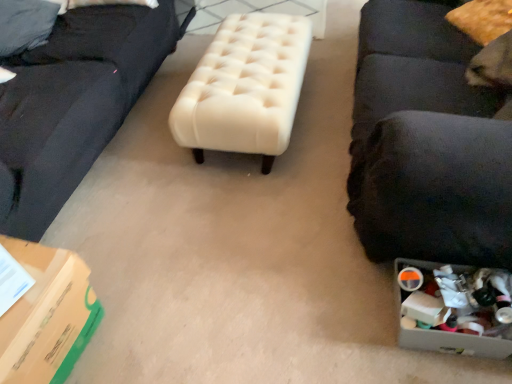
You are a GUI agent. You are given a task and a screenshot of the screen. Output one action in this format:
    pyautogui.click(x=<x>, y=<y>)
    Task: Click on the fuzzy yellow pillow at upper right
    The height and width of the screenshot is (384, 512).
    Given the screenshot: What is the action you would take?
    pyautogui.click(x=482, y=19)

Describe the element at coordinates (245, 88) in the screenshot. This screenshot has height=384, width=512. I see `creamy velvet ottoman at center` at that location.

I want to click on green cardboard box at lower left, so click(47, 316).

Is green cardboard box at lower left facing towards black fabric studio couch at right?

No, green cardboard box at lower left is not facing towards black fabric studio couch at right.

In terms of width, does green cardboard box at lower left look wider or thinner when compared to black fabric studio couch at right?

Clearly, green cardboard box at lower left has less width compared to black fabric studio couch at right.

Considering the positions of points (89, 332) and (497, 129), is point (89, 332) farther from camera compared to point (497, 129)?

Yes.

Is black fabric studio couch at right located outside fuzzy yellow pillow at upper right?

Absolutely, black fabric studio couch at right is external to fuzzy yellow pillow at upper right.

Based on their sizes in the image, would you say black fabric studio couch at right is bigger or smaller than fuzzy yellow pillow at upper right?

Considering their sizes, black fabric studio couch at right takes up more space than fuzzy yellow pillow at upper right.

Is black fabric studio couch at right not near fuzzy yellow pillow at upper right?

That's not correct — black fabric studio couch at right is a little close to fuzzy yellow pillow at upper right.

Is black fabric studio couch at right at the right side of fuzzy yellow pillow at upper right?

No.

From the image's perspective, does fuzzy yellow pillow at upper right appear higher than green cardboard box at lower left?

Yes, from the image's perspective, fuzzy yellow pillow at upper right is above green cardboard box at lower left.

Which object is wider, fuzzy yellow pillow at upper right or green cardboard box at lower left?

With larger width is fuzzy yellow pillow at upper right.

Is fuzzy yellow pillow at upper right to the left of green cardboard box at lower left from the viewer's perspective?

No, fuzzy yellow pillow at upper right is not to the left of green cardboard box at lower left.

Is black fabric studio couch at right aimed at green cardboard box at lower left?

Yes, black fabric studio couch at right is facing green cardboard box at lower left.

Does point (442, 30) come behind point (18, 326)?

Yes, point (442, 30) is farther from viewer.

In the scene shown: Considering the relative sizes of black fabric studio couch at right and green cardboard box at lower left in the image provided, is black fabric studio couch at right bigger than green cardboard box at lower left?

Yes, black fabric studio couch at right is bigger than green cardboard box at lower left.

Considering the sizes of objects black fabric studio couch at right and green cardboard box at lower left in the image provided, who is thinner, black fabric studio couch at right or green cardboard box at lower left?

green cardboard box at lower left is thinner.

Considering the sizes of objects creamy velvet ottoman at center and black fabric studio couch at right in the image provided, who is taller, creamy velvet ottoman at center or black fabric studio couch at right?

Standing taller between the two is black fabric studio couch at right.

Is point (259, 121) positioned after point (461, 258)?

Yes, point (259, 121) is farther from viewer.

Are creamy velvet ottoman at center and black fabric studio couch at right making contact?

No, creamy velvet ottoman at center is not making contact with black fabric studio couch at right.

Which object is thinner, creamy velvet ottoman at center or black fabric studio couch at right?

black fabric studio couch at right.

Is green cardboard box at lower left bigger or smaller than creamy velvet ottoman at center?

In the image, green cardboard box at lower left appears to be smaller than creamy velvet ottoman at center.

Is there a large distance between green cardboard box at lower left and creamy velvet ottoman at center?

Yes, green cardboard box at lower left is far from creamy velvet ottoman at center.

Do you think green cardboard box at lower left is within creamy velvet ottoman at center, or outside of it?

green cardboard box at lower left is not enclosed by creamy velvet ottoman at center.

Based on the photo, between fuzzy yellow pillow at upper right and black fabric studio couch at right, which one has more height?

black fabric studio couch at right is taller.

Is fuzzy yellow pillow at upper right looking in the opposite direction of black fabric studio couch at right?

Yes, fuzzy yellow pillow at upper right is positioned with its back facing black fabric studio couch at right.

Considering the sizes of objects fuzzy yellow pillow at upper right and black fabric studio couch at right in the image provided, who is wider, fuzzy yellow pillow at upper right or black fabric studio couch at right?

With larger width is black fabric studio couch at right.

At what (x,y) coordinates should I click in order to perform the action: click on cardboard box below the black fabric studio couch at right (from a real-world perspective). Please return your answer as a coordinate pair (x, y). The image size is (512, 384). Looking at the image, I should click on (47, 316).

Where is `pillow that is behind the black fabric studio couch at right`? pillow that is behind the black fabric studio couch at right is located at coordinates (482, 19).

Estimate the real-world distances between objects in this image. Which object is closer to black fabric studio couch at right, creamy velvet ottoman at center or green cardboard box at lower left?

Based on the image, creamy velvet ottoman at center appears to be nearer to black fabric studio couch at right.

Which object lies nearer to the anchor point fuzzy yellow pillow at upper right, black fabric studio couch at right or creamy velvet ottoman at center?

Based on the image, black fabric studio couch at right appears to be nearer to fuzzy yellow pillow at upper right.

Looking at this image, looking at the image, which one is located further to fuzzy yellow pillow at upper right, plastic container at lower right or green cardboard box at lower left?

The object further to fuzzy yellow pillow at upper right is green cardboard box at lower left.

Which object lies nearer to the anchor point green cardboard box at lower left, plastic container at lower right or creamy velvet ottoman at center?

The object closer to green cardboard box at lower left is creamy velvet ottoman at center.

Considering their positions, is creamy velvet ottoman at center positioned closer to fuzzy yellow pillow at upper right than green cardboard box at lower left?

The object closer to fuzzy yellow pillow at upper right is creamy velvet ottoman at center.

Based on their spatial positions, is black fabric studio couch at right or fuzzy yellow pillow at upper right further from plastic container at lower right?

fuzzy yellow pillow at upper right.

Considering their positions, is green cardboard box at lower left positioned closer to creamy velvet ottoman at center than black fabric studio couch at right?

The object closer to creamy velvet ottoman at center is black fabric studio couch at right.

Which object lies further to the anchor point creamy velvet ottoman at center, plastic container at lower right or fuzzy yellow pillow at upper right?

The object further to creamy velvet ottoman at center is plastic container at lower right.

At what (x,y) coordinates should I click in order to perform the action: click on table situated between green cardboard box at lower left and plastic container at lower right from left to right. Please return your answer as a coordinate pair (x, y). The image size is (512, 384). Looking at the image, I should click on (245, 88).

You are a GUI agent. You are given a task and a screenshot of the screen. Output one action in this format:
    pyautogui.click(x=<x>, y=<y>)
    Task: Click on the storage box located between green cardboard box at lower left and fuzzy yellow pillow at upper right in the left-right direction
    
    Given the screenshot: What is the action you would take?
    pyautogui.click(x=452, y=308)

Identify the location of table between black fabric studio couch at right and plastic container at lower right in the vertical direction. (245, 88).

I want to click on storage box between green cardboard box at lower left and black fabric studio couch at right from left to right, so click(x=452, y=308).